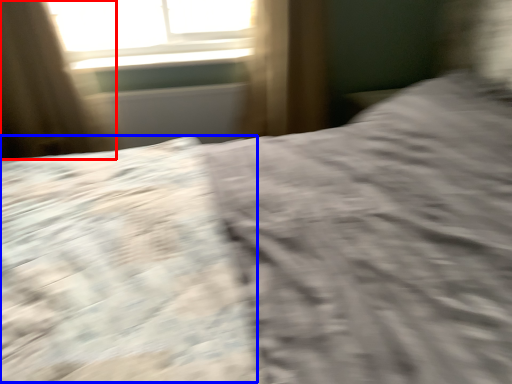
Question: Which object is closer to the camera taking this photo, curtain (highlighted by a red box) or sheet (highlighted by a blue box)?

Choices:
 (A) curtain
 (B) sheet

Answer: (B)